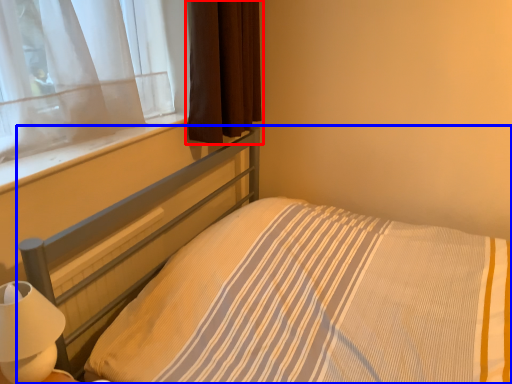
Question: Which object is further to the camera taking this photo, curtain (highlighted by a red box) or bed (highlighted by a blue box)?

Choices:
 (A) curtain
 (B) bed

Answer: (A)